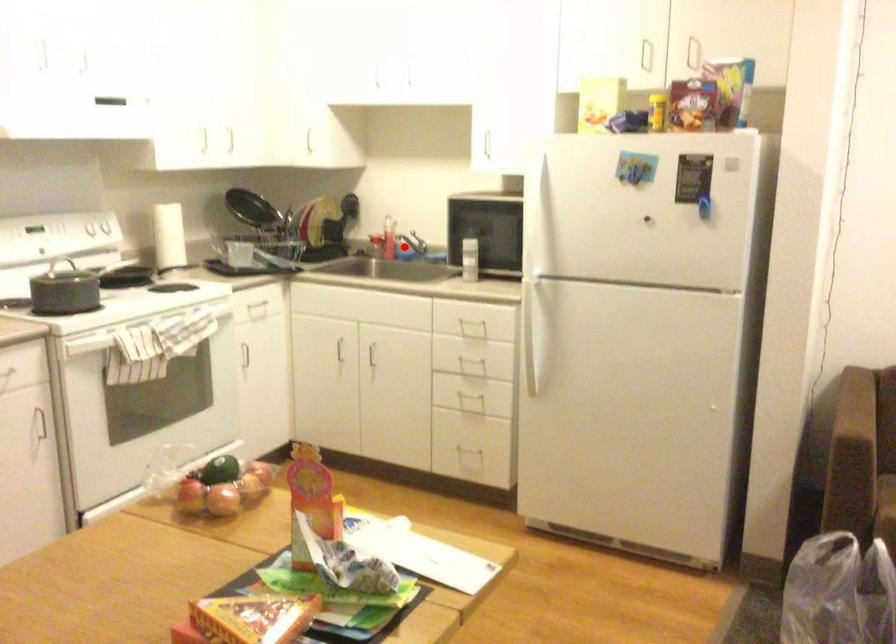
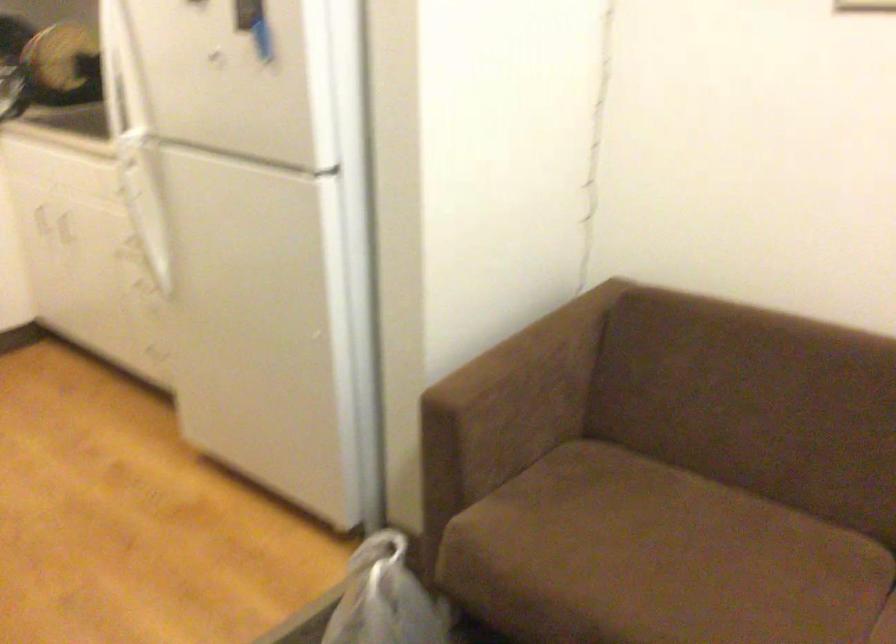
Question: I am providing you with two images of the same scene from different viewpoints. A red point is marked on the first image. Can you still see the location of the red point in image 2?

Choices:
 (A) Yes
 (B) No

Answer: (B)